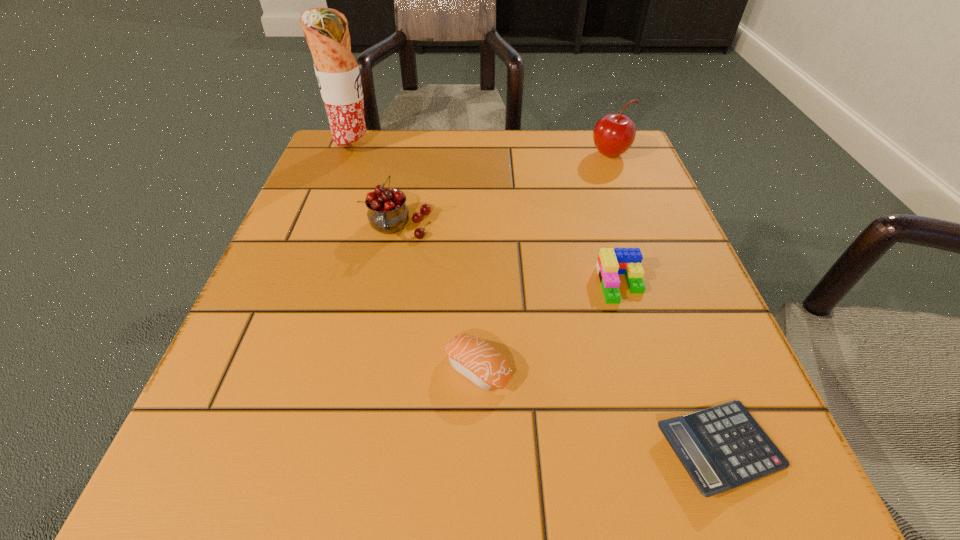
Identify which object is located as the second nearest to the fifth object from right to left. Please provide its 2D coordinates. Your answer should be formatted as a tuple, i.e. [(x, y)], where the tuple contains the x and y coordinates of a point satisfying the conditions above.

[(476, 360)]

The width and height of the screenshot is (960, 540). Identify the location of free space that satisfies the following two spatial constraints: 1. on the front side of the farther cherry; 2. on the right side of the leftmost object. (351, 154).

The height and width of the screenshot is (540, 960). What are the coordinates of `free space that satisfies the following two spatial constraints: 1. on the back side of the farther cherry; 2. on the right side of the third nearest object` in the screenshot? It's located at (582, 154).